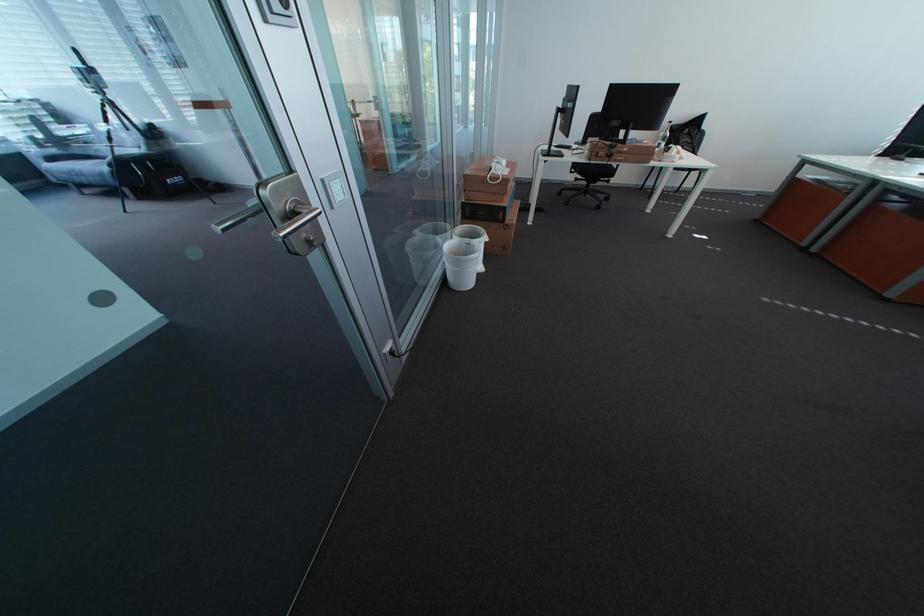
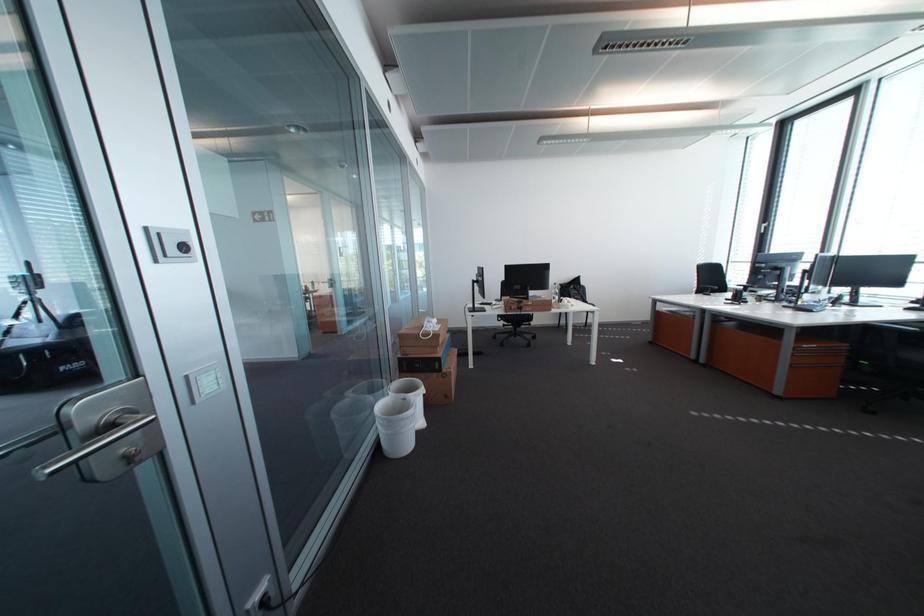
Question: How did the camera likely rotate?

Choices:
 (A) Left
 (B) Right
 (C) Up
 (D) Down

Answer: (C)